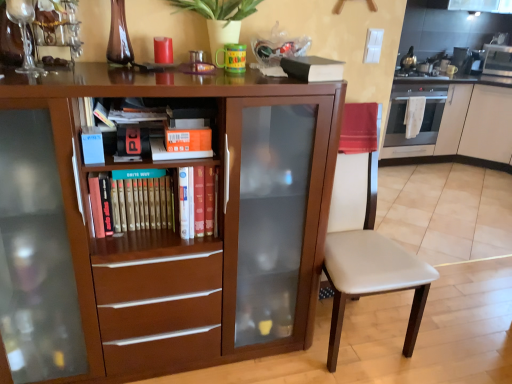
Question: Can you confirm if white glossy cabinet at right, the 1th cabinetry in the back-to-front sequence, is taller than hardcover book at left, the 1th paperback book when ordered from left to right?

Choices:
 (A) no
 (B) yes

Answer: (B)

Question: From the image's perspective, does white glossy cabinet at right, which is counted as the 2th cabinetry, starting from the front, appear lower than hardcover book at left, the 1th paperback book when ordered from left to right?

Choices:
 (A) yes
 (B) no

Answer: (B)

Question: Is white glossy cabinet at right, which is counted as the 2th cabinetry, starting from the front, not close to hardcover book at left, positioned as the 1th paperback book in bottom-to-top order?

Choices:
 (A) no
 (B) yes

Answer: (B)

Question: From the image's perspective, is white glossy cabinet at right, the 1th cabinetry in the back-to-front sequence, located above hardcover book at left, which is the 4th paperback book in top-to-bottom order?

Choices:
 (A) yes
 (B) no

Answer: (A)

Question: Does white glossy cabinet at right, the 1th cabinetry in the back-to-front sequence, have a lesser width compared to hardcover book at left, arranged as the 4th paperback book when viewed from the right?

Choices:
 (A) no
 (B) yes

Answer: (A)

Question: Is hardcover book at center in front of or behind green matte plant at upper center in the image?

Choices:
 (A) behind
 (B) front

Answer: (A)

Question: Based on their positions, is hardcover book at center located to the left or right of green matte plant at upper center?

Choices:
 (A) right
 (B) left

Answer: (B)

Question: In terms of size, does hardcover book at center appear bigger or smaller than green matte plant at upper center?

Choices:
 (A) small
 (B) big

Answer: (A)

Question: From a real-world perspective, is hardcover book at center physically located above or below green matte plant at upper center?

Choices:
 (A) above
 (B) below

Answer: (B)

Question: Considering the positions of brown matte cabinet at center, which appears as the first cabinetry when viewed from the front, and satin silver oven at right in the image, is brown matte cabinet at center, which appears as the first cabinetry when viewed from the front, taller or shorter than satin silver oven at right?

Choices:
 (A) short
 (B) tall

Answer: (B)

Question: Considering the positions of point (185, 87) and point (395, 117), is point (185, 87) closer or farther from the camera than point (395, 117)?

Choices:
 (A) closer
 (B) farther

Answer: (A)

Question: In terms of size, does brown matte cabinet at center, placed as the 2th cabinetry when sorted from back to front, appear bigger or smaller than satin silver oven at right?

Choices:
 (A) big
 (B) small

Answer: (A)

Question: Visually, is brown matte cabinet at center, placed as the 1th cabinetry when sorted from left to right, positioned to the left or to the right of satin silver oven at right?

Choices:
 (A) right
 (B) left

Answer: (B)

Question: Considering the positions of white leather chair at center and black matte book at upper center, positioned as the 4th paperback book in bottom-to-top order, in the image, is white leather chair at center taller or shorter than black matte book at upper center, positioned as the 4th paperback book in bottom-to-top order,?

Choices:
 (A) short
 (B) tall

Answer: (B)

Question: Based on their sizes in the image, would you say white leather chair at center is bigger or smaller than black matte book at upper center, marked as the 1th paperback book in a top-to-bottom arrangement?

Choices:
 (A) small
 (B) big

Answer: (B)